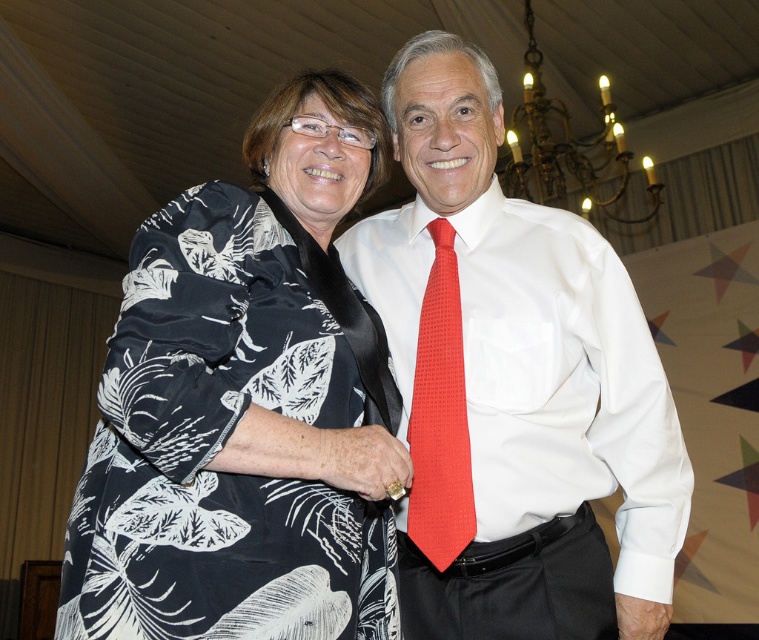
Locate an element on the screen. This screenshot has height=640, width=759. white smooth shirt at center is located at coordinates (512, 385).

Can you confirm if white smooth shirt at center is wider than red textured tie at center?

Yes.

Is point (389, 216) more distant than point (449, 289)?

Yes, it is.

Where is `white smooth shirt at center`? white smooth shirt at center is located at coordinates (512, 385).

Does black floral fabric dress at left have a greater height compared to red textured tie at center?

Indeed, black floral fabric dress at left has a greater height compared to red textured tie at center.

Is black floral fabric dress at left positioned behind red textured tie at center?

No, it is in front of red textured tie at center.

Is point (232, 605) farther from viewer compared to point (432, 552)?

That is False.

The width and height of the screenshot is (759, 640). Identify the location of black floral fabric dress at left. (227, 436).

The width and height of the screenshot is (759, 640). What do you see at coordinates (512, 385) in the screenshot? I see `white smooth shirt at center` at bounding box center [512, 385].

Who is positioned more to the right, white smooth shirt at center or black floral fabric dress at left?

white smooth shirt at center is more to the right.

Which is in front, point (408, 259) or point (288, 618)?

Positioned in front is point (288, 618).

Identify the location of white smooth shirt at center. (512, 385).